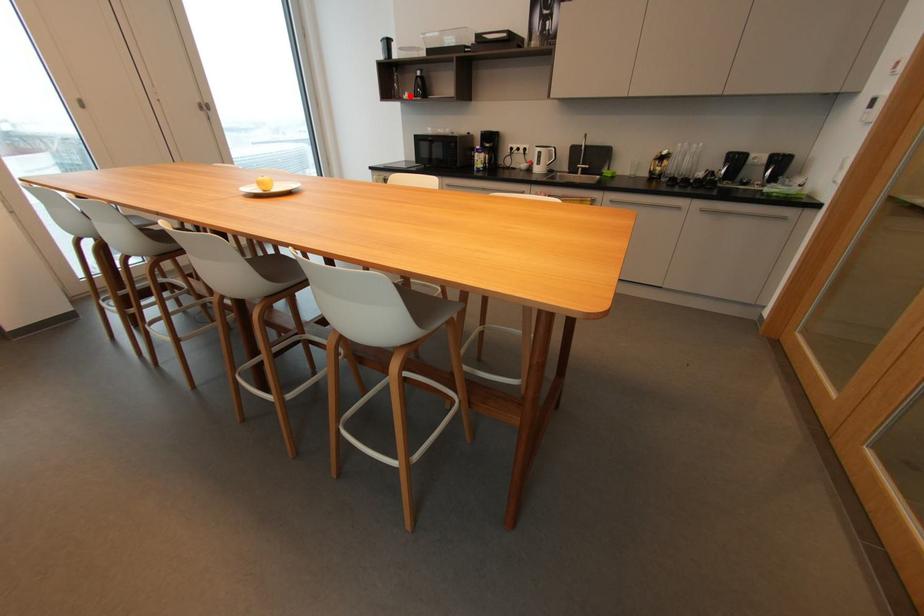
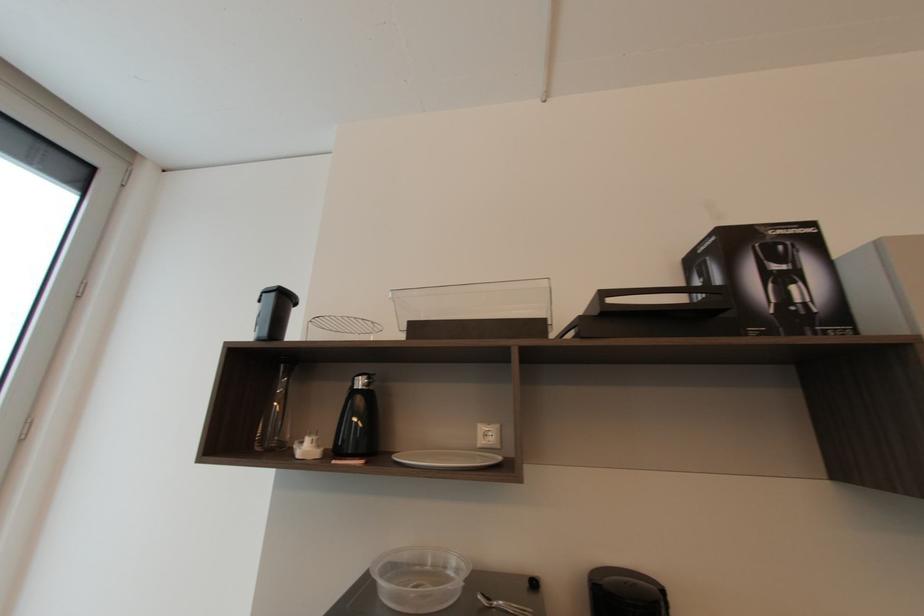
Question: I am providing you with two images of the same scene from different viewpoints. Given a red point in image1, look at the same physical point in image2. Is it:

Choices:
 (A) Closer to the viewpoint
 (B) Farther from the viewpoint

Answer: (B)